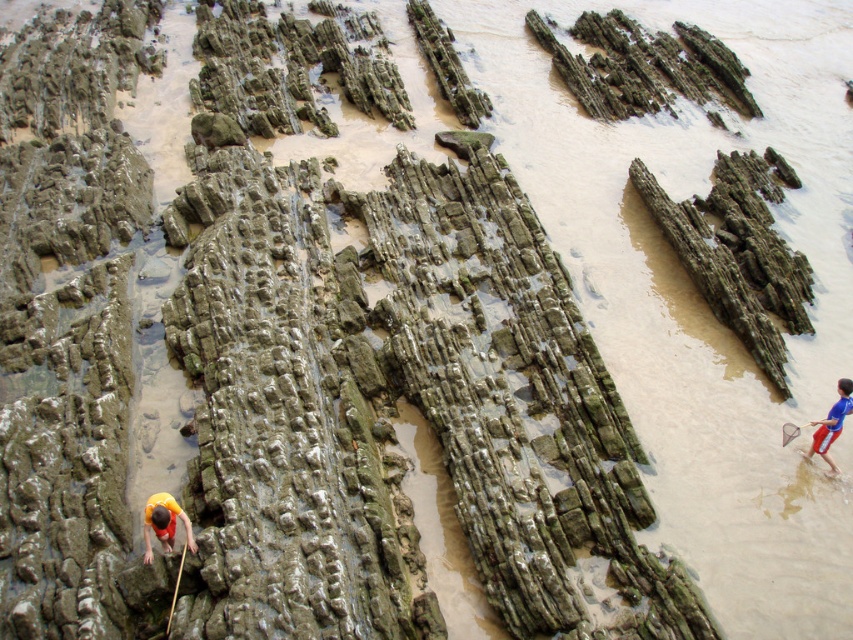
Question: Is yellow fabric at lower left bigger than blue jersey at lower right?

Choices:
 (A) no
 (B) yes

Answer: (A)

Question: Which of the following is the farthest from the observer?

Choices:
 (A) (155, 531)
 (B) (836, 417)

Answer: (B)

Question: Where is yellow fabric at lower left located in relation to blue jersey at lower right in the image?

Choices:
 (A) below
 (B) above

Answer: (A)

Question: Where is yellow fabric at lower left located in relation to blue jersey at lower right in the image?

Choices:
 (A) right
 (B) left

Answer: (B)